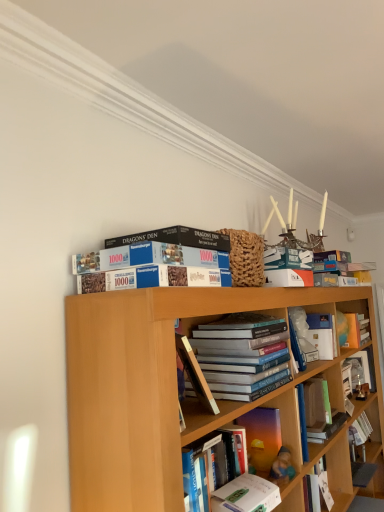
Question: Does wooden photo frame at right, placed as the ninth book when sorted from front to back, have a greater width compared to translucent plastic book at center, the sixth book in the back-to-front sequence?

Choices:
 (A) no
 (B) yes

Answer: (A)

Question: From the image's perspective, does wooden photo frame at right, which is the first book from back to front, appear lower than translucent plastic book at center, which is counted as the 4th book, starting from the front?

Choices:
 (A) no
 (B) yes

Answer: (B)

Question: Is translucent plastic book at center, which is counted as the 4th book, starting from the front, inside wooden photo frame at right, which is the first book from back to front?

Choices:
 (A) yes
 (B) no

Answer: (B)

Question: Is wooden photo frame at right, placed as the ninth book when sorted from front to back, positioned with its back to translucent plastic book at center, the sixth book in the back-to-front sequence?

Choices:
 (A) yes
 (B) no

Answer: (B)

Question: Considering the relative sizes of wooden photo frame at right, which is the first book from back to front, and translucent plastic book at center, which is counted as the 4th book, starting from the front, in the image provided, is wooden photo frame at right, which is the first book from back to front, taller than translucent plastic book at center, which is counted as the 4th book, starting from the front,?

Choices:
 (A) yes
 (B) no

Answer: (A)

Question: From the image's perspective, relative to hardcover book at center, is hardcover books at center, arranged as the seventh book when viewed from the back, above or below?

Choices:
 (A) above
 (B) below

Answer: (B)

Question: Considering the positions of hardcover books at center, arranged as the seventh book when viewed from the back, and hardcover book at center in the image, is hardcover books at center, arranged as the seventh book when viewed from the back, taller or shorter than hardcover book at center?

Choices:
 (A) short
 (B) tall

Answer: (B)

Question: Choose the correct answer: Is hardcover books at center, the third book in the front-to-back sequence, inside hardcover book at center or outside it?

Choices:
 (A) inside
 (B) outside

Answer: (B)

Question: Considering the positions of hardcover books at center, arranged as the seventh book when viewed from the back, and hardcover book at center in the image, is hardcover books at center, arranged as the seventh book when viewed from the back, bigger or smaller than hardcover book at center?

Choices:
 (A) big
 (B) small

Answer: (A)

Question: Considering the relative positions of hardcover book at center and hardcover book at center, which appears as the seventh book when viewed from the front, in the image provided, is hardcover book at center to the left or to the right of hardcover book at center, which appears as the seventh book when viewed from the front,?

Choices:
 (A) left
 (B) right

Answer: (A)

Question: Is hardcover book at center bigger or smaller than hardcover book at center, which appears as the seventh book when viewed from the front?

Choices:
 (A) big
 (B) small

Answer: (A)

Question: Is hardcover book at center inside the boundaries of hardcover book at center, marked as the third book in a back-to-front arrangement, or outside?

Choices:
 (A) outside
 (B) inside

Answer: (A)

Question: From a real-world perspective, is hardcover book at center positioned above or below hardcover book at center, marked as the third book in a back-to-front arrangement?

Choices:
 (A) below
 (B) above

Answer: (B)

Question: Is hardcover book at center, which appears as the seventh book when viewed from the front, taller or shorter than hardcover book at center?

Choices:
 (A) tall
 (B) short

Answer: (A)

Question: Would you say hardcover book at center, marked as the third book in a back-to-front arrangement, is inside or outside hardcover book at center?

Choices:
 (A) inside
 (B) outside

Answer: (B)